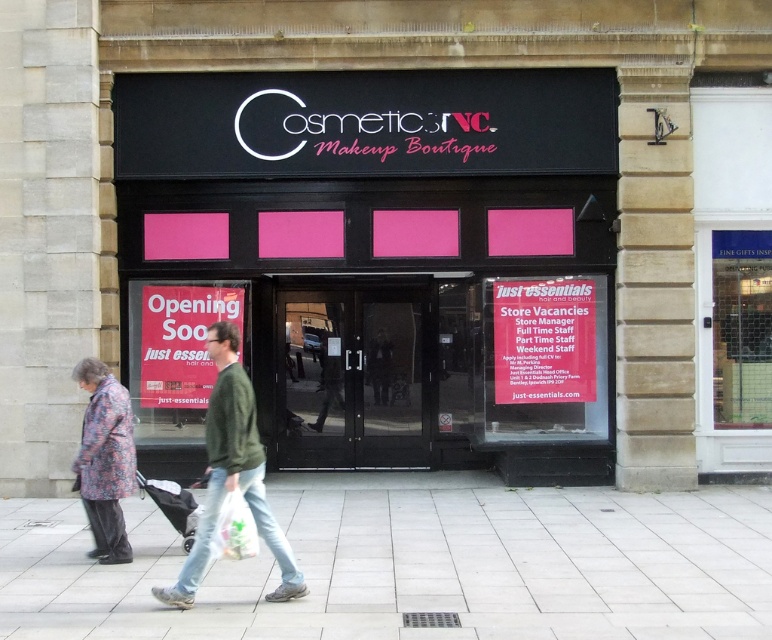
Question: Which point appears closest to the camera in this image?

Choices:
 (A) (496, 486)
 (B) (107, 536)

Answer: (B)

Question: Which point is farther to the camera?

Choices:
 (A) black matte signboard at center
 (B) green cotton jacket at center
 (C) smooth concrete pavement at lower center

Answer: (A)

Question: Does floral fabric coat at lower left have a greater width compared to white plastic bag at lower center?

Choices:
 (A) yes
 (B) no

Answer: (A)

Question: Is smooth concrete pavement at lower center to the left of floral fabric coat at lower left from the viewer's perspective?

Choices:
 (A) no
 (B) yes

Answer: (A)

Question: Does floral fabric coat at lower left appear under white plastic bag at lower center?

Choices:
 (A) no
 (B) yes

Answer: (A)

Question: Which point is farther to the camera?

Choices:
 (A) 239,557
 (B) 564,317
 (C) 391,625

Answer: (B)